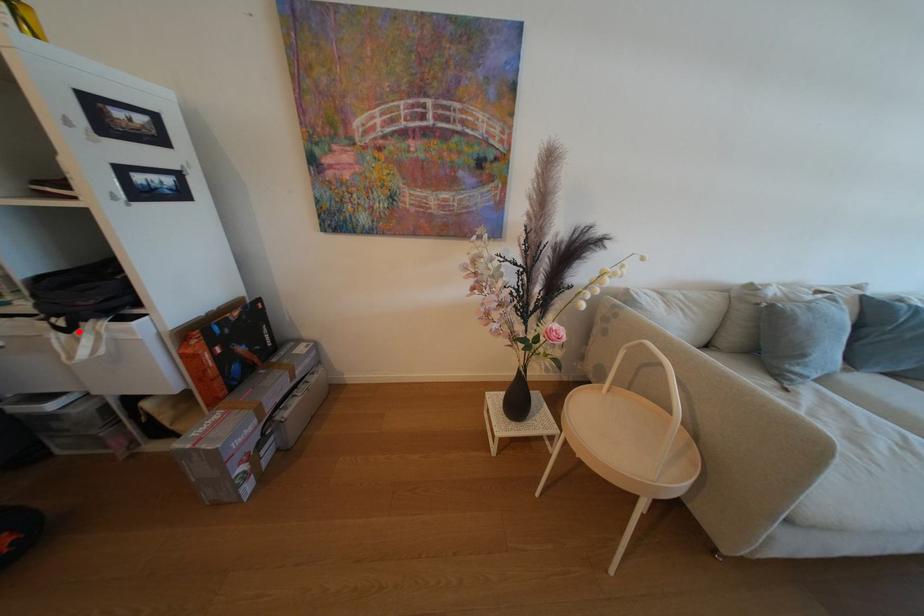
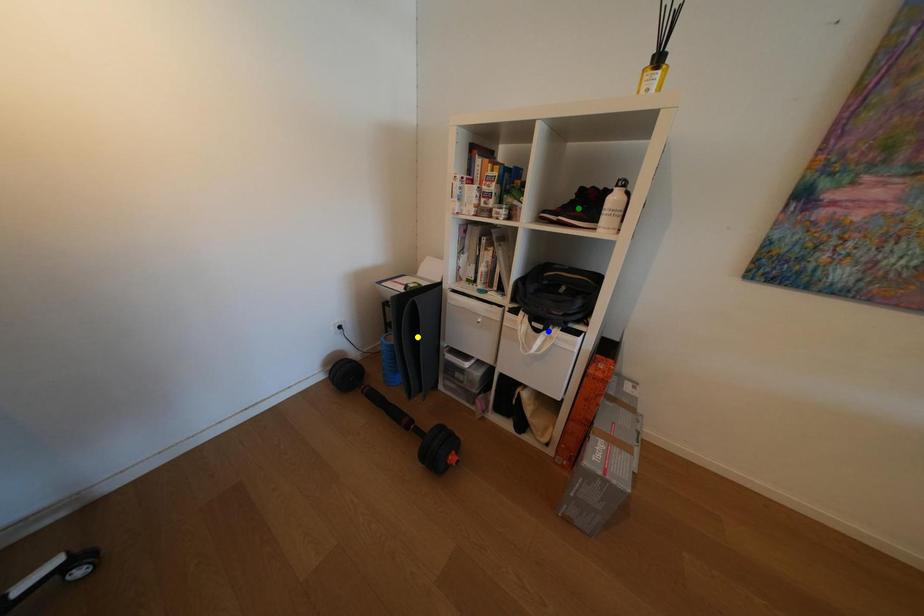
Question: I am providing you with two images of the same scene from different viewpoints. A red point is marked on the first image. You are given multiple points on the second image. Which spot in image 2 lines up with the point in image 1?

Choices:
 (A) yellow point
 (B) blue point
 (C) green point

Answer: (B)